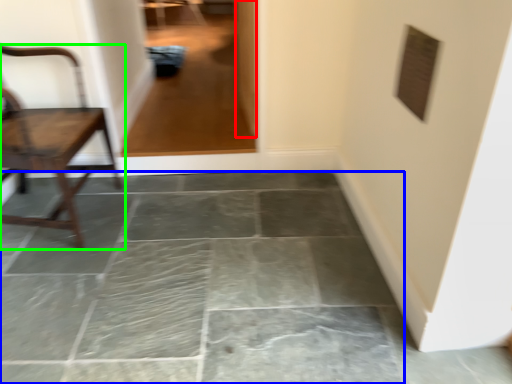
Question: Estimate the real-world distances between objects in this image. Which object is farther from glass door (highlighted by a red box), concrete (highlighted by a blue box) or chair (highlighted by a green box)?

Choices:
 (A) concrete
 (B) chair

Answer: (A)